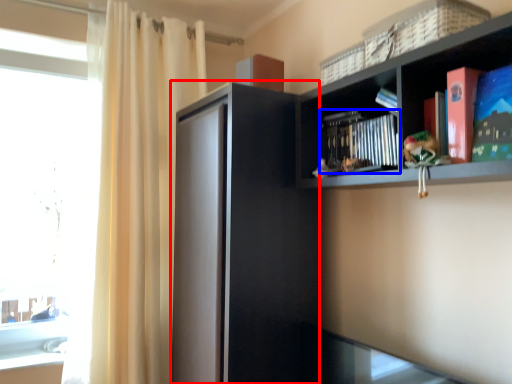
Question: Which point is further to the camera, screen door (highlighted by a red box) or book (highlighted by a blue box)?

Choices:
 (A) screen door
 (B) book

Answer: (A)